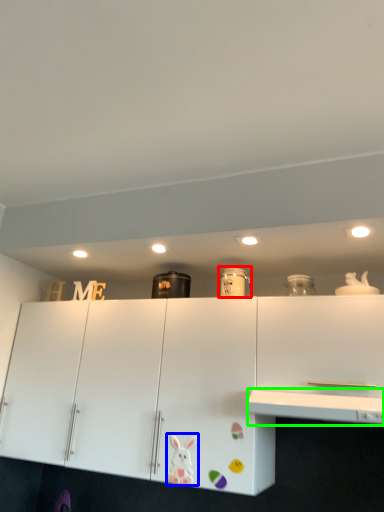
Question: Based on their relative distances, which object is farther from appliance (highlighted by a red box)? Choose from animal (highlighted by a blue box) and counter top (highlighted by a green box).

Choices:
 (A) animal
 (B) counter top

Answer: (A)